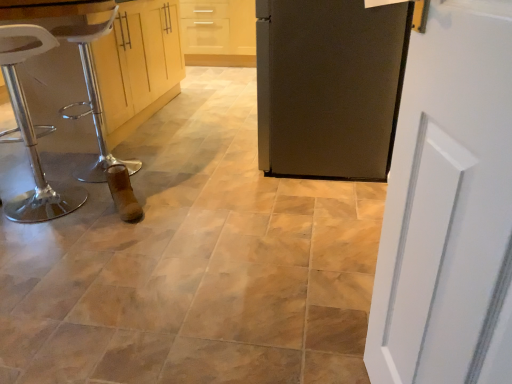
Question: Considering the relative positions of white painted wood door at right, positioned as the first door in left-to-right order, and matte black refrigerator at center, the second door viewed from the left, in the image provided, is white painted wood door at right, positioned as the first door in left-to-right order, in front of matte black refrigerator at center, the second door viewed from the left,?

Choices:
 (A) yes
 (B) no

Answer: (A)

Question: Is white painted wood door at right, which is the 2th door in right-to-left order, positioned with its back to matte black refrigerator at center, the second door viewed from the left?

Choices:
 (A) no
 (B) yes

Answer: (A)

Question: Does white painted wood door at right, which is the 2th door in right-to-left order, touch matte black refrigerator at center, which is the 2th door from front to back?

Choices:
 (A) yes
 (B) no

Answer: (B)

Question: Is white painted wood door at right, positioned as the first door in left-to-right order, thinner than matte black refrigerator at center, which is the 2th door from front to back?

Choices:
 (A) yes
 (B) no

Answer: (A)

Question: Is white painted wood door at right, the second door viewed from the back, bigger than matte black refrigerator at center, the 1th door positioned from the back?

Choices:
 (A) no
 (B) yes

Answer: (A)

Question: From the image's perspective, is matte wood cabinetry at left positioned above or below white plastic bar stool at left?

Choices:
 (A) above
 (B) below

Answer: (A)

Question: Is matte wood cabinetry at left in front of or behind white plastic bar stool at left in the image?

Choices:
 (A) behind
 (B) front

Answer: (A)

Question: From their relative heights in the image, would you say matte wood cabinetry at left is taller or shorter than white plastic bar stool at left?

Choices:
 (A) short
 (B) tall

Answer: (A)

Question: Looking at their shapes, would you say matte wood cabinetry at left is wider or thinner than white plastic bar stool at left?

Choices:
 (A) thin
 (B) wide

Answer: (B)

Question: Is white painted wood door at right, which is the first door from bottom to top, inside or outside of white plastic bar stool at left?

Choices:
 (A) outside
 (B) inside

Answer: (A)

Question: Would you say white painted wood door at right, the second door viewed from the back, is to the left or to the right of white plastic bar stool at left in the picture?

Choices:
 (A) left
 (B) right

Answer: (B)

Question: Based on their sizes in the image, would you say white painted wood door at right, positioned as the first door in left-to-right order, is bigger or smaller than white plastic bar stool at left?

Choices:
 (A) big
 (B) small

Answer: (B)

Question: From the image's perspective, is white painted wood door at right, positioned as the first door in left-to-right order, above or below white plastic bar stool at left?

Choices:
 (A) above
 (B) below

Answer: (B)

Question: From their relative heights in the image, would you say white plastic stool at left is taller or shorter than matte black refrigerator at center, the 1th door from the top?

Choices:
 (A) tall
 (B) short

Answer: (B)

Question: Is white plastic stool at left to the left or to the right of matte black refrigerator at center, the 1th door positioned from the back, in the image?

Choices:
 (A) left
 (B) right

Answer: (A)